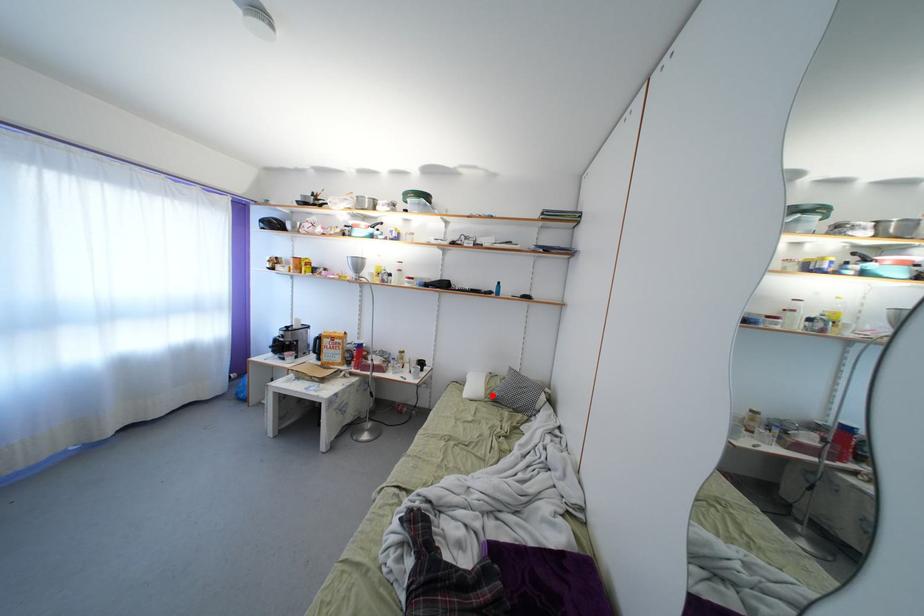
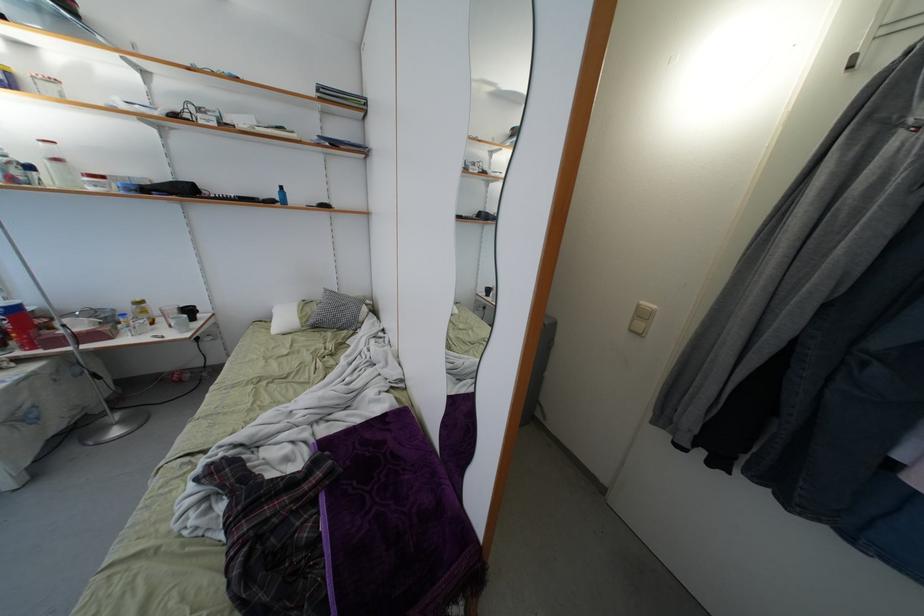
The point at the highlighted location is marked in the first image. Where is the corresponding point in the second image?

(306, 323)